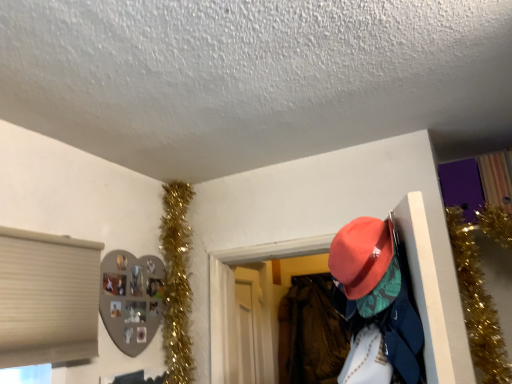
Question: Is velvet-like orange hat at center-right completely or partially outside of gold tinsel garland at upper left?

Choices:
 (A) yes
 (B) no

Answer: (A)

Question: Does velvet-like orange hat at center-right have a lesser width compared to gold tinsel garland at upper left?

Choices:
 (A) yes
 (B) no

Answer: (B)

Question: Can you confirm if velvet-like orange hat at center-right is shorter than gold tinsel garland at upper left?

Choices:
 (A) no
 (B) yes

Answer: (B)

Question: Considering the relative sizes of velvet-like orange hat at center-right and gold tinsel garland at upper left in the image provided, is velvet-like orange hat at center-right wider than gold tinsel garland at upper left?

Choices:
 (A) yes
 (B) no

Answer: (A)

Question: From a real-world perspective, is velvet-like orange hat at center-right located higher than gold tinsel garland at upper left?

Choices:
 (A) no
 (B) yes

Answer: (A)

Question: From a real-world perspective, is matte orange hat at upper right positioned above or below gold tinsel garland at upper left?

Choices:
 (A) below
 (B) above

Answer: (A)

Question: Considering their positions, is matte orange hat at upper right located in front of or behind gold tinsel garland at upper left?

Choices:
 (A) front
 (B) behind

Answer: (A)

Question: From the image's perspective, is matte orange hat at upper right located above or below gold tinsel garland at upper left?

Choices:
 (A) above
 (B) below

Answer: (A)

Question: Is matte orange hat at upper right inside the boundaries of gold tinsel garland at upper left, or outside?

Choices:
 (A) outside
 (B) inside

Answer: (A)

Question: From a real-world perspective, is velvet-like orange hat at center-right physically located above or below gold tinsel garland at upper left?

Choices:
 (A) above
 (B) below

Answer: (B)

Question: Is point (325, 355) closer or farther from the camera than point (172, 259)?

Choices:
 (A) farther
 (B) closer

Answer: (A)

Question: In the image, is velvet-like orange hat at center-right on the left side or the right side of gold tinsel garland at upper left?

Choices:
 (A) left
 (B) right

Answer: (B)

Question: From the image's perspective, relative to gold tinsel garland at upper left, is velvet-like orange hat at center-right above or below?

Choices:
 (A) above
 (B) below

Answer: (B)

Question: In terms of size, does gold tinsel garland at upper left appear bigger or smaller than matte orange hat at upper right?

Choices:
 (A) big
 (B) small

Answer: (B)

Question: Considering the relative positions of gold tinsel garland at upper left and matte orange hat at upper right in the image provided, is gold tinsel garland at upper left to the left or to the right of matte orange hat at upper right?

Choices:
 (A) right
 (B) left

Answer: (B)